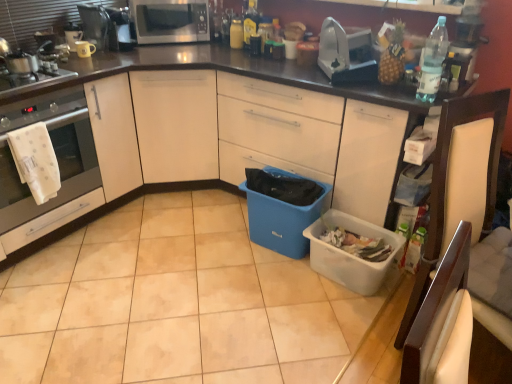
Question: Is metallic coffee maker at upper left, the 3th appliance positioned from the left, completely or partially outside of blue plastic bin at center, which appears as the first storage box when viewed from the left?

Choices:
 (A) no
 (B) yes

Answer: (B)

Question: Is metallic coffee maker at upper left, the 3th appliance positioned from the left, shorter than blue plastic bin at center, which appears as the first storage box when viewed from the left?

Choices:
 (A) no
 (B) yes

Answer: (B)

Question: Are metallic coffee maker at upper left, the third appliance when ordered from right to left, and blue plastic bin at center, the second storage box positioned from the right, far apart?

Choices:
 (A) no
 (B) yes

Answer: (B)

Question: Is metallic coffee maker at upper left, the 3th appliance positioned from the left, at the left side of blue plastic bin at center, the second storage box positioned from the right?

Choices:
 (A) no
 (B) yes

Answer: (B)

Question: Can you confirm if metallic coffee maker at upper left, the third appliance when ordered from right to left, is wider than blue plastic bin at center, the second storage box positioned from the right?

Choices:
 (A) yes
 (B) no

Answer: (B)

Question: In terms of size, does white plastic storage box at lower right, the 2th storage box from the left, appear bigger or smaller than satin silver gas stove at left?

Choices:
 (A) big
 (B) small

Answer: (A)

Question: In terms of height, does white plastic storage box at lower right, which is counted as the first storage box, starting from the right, look taller or shorter compared to satin silver gas stove at left?

Choices:
 (A) tall
 (B) short

Answer: (A)

Question: From the image's perspective, is white plastic storage box at lower right, which is counted as the first storage box, starting from the right, located above or below satin silver gas stove at left?

Choices:
 (A) below
 (B) above

Answer: (A)

Question: From a real-world perspective, is white plastic storage box at lower right, the 2th storage box from the left, physically located above or below satin silver gas stove at left?

Choices:
 (A) above
 (B) below

Answer: (B)

Question: Visually, is blue plastic bin at center, the second storage box positioned from the right, positioned to the left or to the right of white plastic storage box at lower right, the 2th storage box from the left?

Choices:
 (A) left
 (B) right

Answer: (A)

Question: In terms of width, does blue plastic bin at center, the second storage box positioned from the right, look wider or thinner when compared to white plastic storage box at lower right, the 2th storage box from the left?

Choices:
 (A) wide
 (B) thin

Answer: (B)

Question: Considering the positions of blue plastic bin at center, which appears as the first storage box when viewed from the left, and white plastic storage box at lower right, the 2th storage box from the left, in the image, is blue plastic bin at center, which appears as the first storage box when viewed from the left, bigger or smaller than white plastic storage box at lower right, the 2th storage box from the left,?

Choices:
 (A) big
 (B) small

Answer: (A)

Question: Considering the positions of point (296, 175) and point (324, 248), is point (296, 175) closer or farther from the camera than point (324, 248)?

Choices:
 (A) closer
 (B) farther

Answer: (B)

Question: From the image's perspective, is yellow matte mug at upper left, which appears as the second appliance when viewed from the left, above or below clear plastic bottle at upper right, which is the 3th bottle in top-to-bottom order?

Choices:
 (A) above
 (B) below

Answer: (A)

Question: Looking at their shapes, would you say yellow matte mug at upper left, which appears as the second appliance when viewed from the left, is wider or thinner than clear plastic bottle at upper right, which appears as the 3th bottle when viewed from the left?

Choices:
 (A) wide
 (B) thin

Answer: (B)